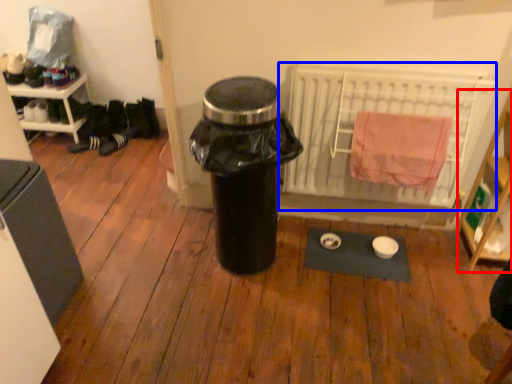
Question: Which object is further to the camera taking this photo, shelf (highlighted by a red box) or radiator (highlighted by a blue box)?

Choices:
 (A) shelf
 (B) radiator

Answer: (B)